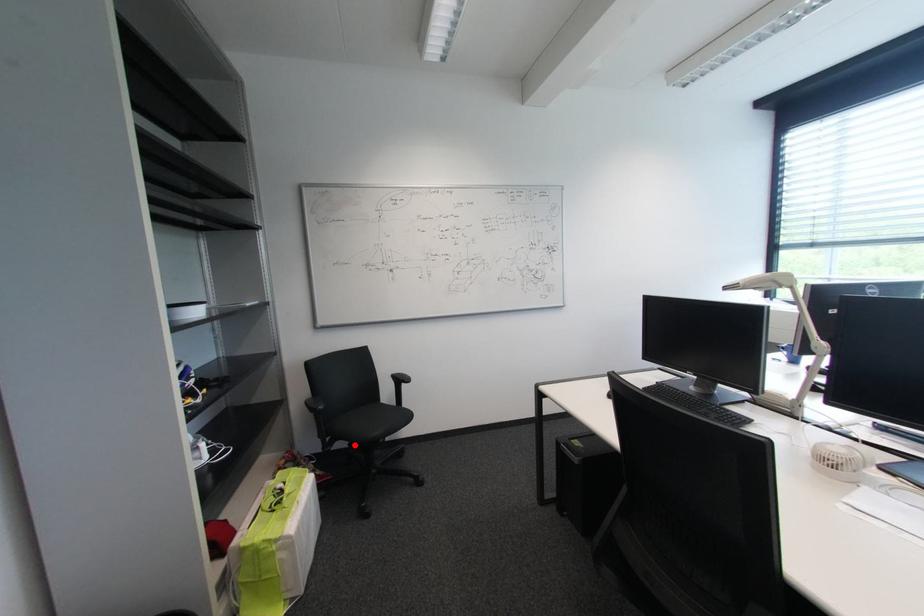
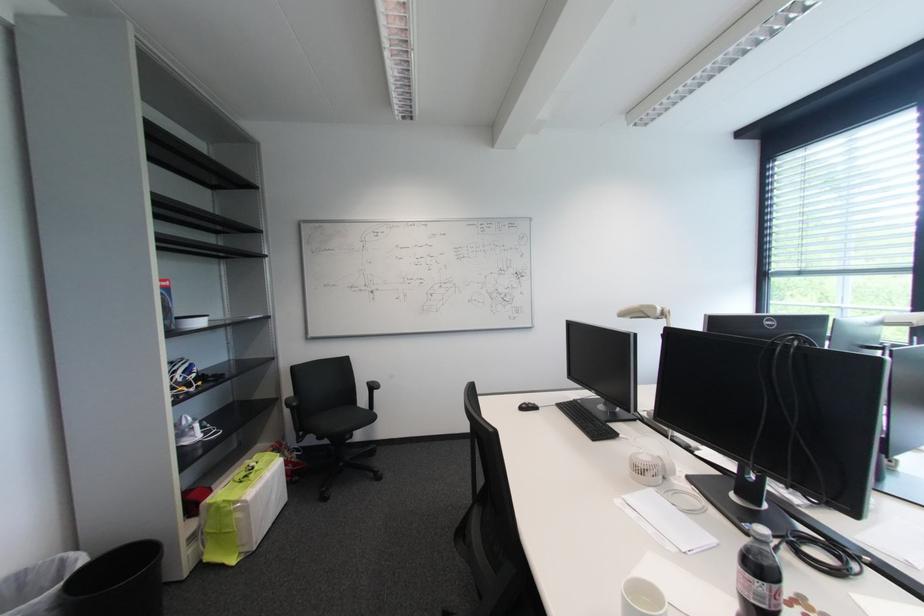
Locate, in the second image, the point that corresponds to the highlighted location in the first image.

(322, 438)